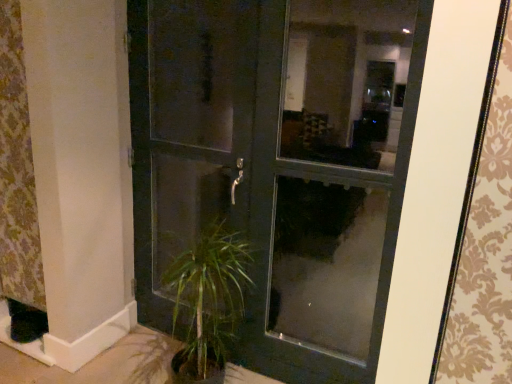
Question: Does matte black screen door at center have a lesser width compared to patterned fabric curtain at left?

Choices:
 (A) yes
 (B) no

Answer: (B)

Question: Is matte black screen door at center not within patterned fabric curtain at left?

Choices:
 (A) no
 (B) yes

Answer: (B)

Question: Can you confirm if matte black screen door at center is positioned to the right of patterned fabric curtain at left?

Choices:
 (A) yes
 (B) no

Answer: (A)

Question: Are matte black screen door at center and patterned fabric curtain at left located far from each other?

Choices:
 (A) no
 (B) yes

Answer: (A)

Question: Does matte black screen door at center have a smaller size compared to patterned fabric curtain at left?

Choices:
 (A) no
 (B) yes

Answer: (A)

Question: Is patterned fabric curtain at left in front of or behind matte black door at center in the image?

Choices:
 (A) behind
 (B) front

Answer: (A)

Question: Visually, is patterned fabric curtain at left positioned to the left or to the right of matte black door at center?

Choices:
 (A) left
 (B) right

Answer: (A)

Question: Is point (12, 125) positioned closer to the camera than point (349, 183)?

Choices:
 (A) farther
 (B) closer

Answer: (A)

Question: From the image's perspective, is patterned fabric curtain at left above or below matte black door at center?

Choices:
 (A) below
 (B) above

Answer: (B)

Question: From the image's perspective, is matte black screen door at center above or below matte black door at center?

Choices:
 (A) above
 (B) below

Answer: (A)

Question: Based on their sizes in the image, would you say matte black screen door at center is bigger or smaller than matte black door at center?

Choices:
 (A) small
 (B) big

Answer: (A)

Question: From a real-world perspective, is matte black screen door at center above or below matte black door at center?

Choices:
 (A) above
 (B) below

Answer: (A)

Question: Considering the positions of matte black screen door at center and matte black door at center in the image, is matte black screen door at center taller or shorter than matte black door at center?

Choices:
 (A) short
 (B) tall

Answer: (B)

Question: In the image, is matte black door at center on the left side or the right side of patterned fabric curtain at left?

Choices:
 (A) left
 (B) right

Answer: (B)

Question: From a real-world perspective, relative to patterned fabric curtain at left, is matte black door at center vertically above or below?

Choices:
 (A) below
 (B) above

Answer: (A)